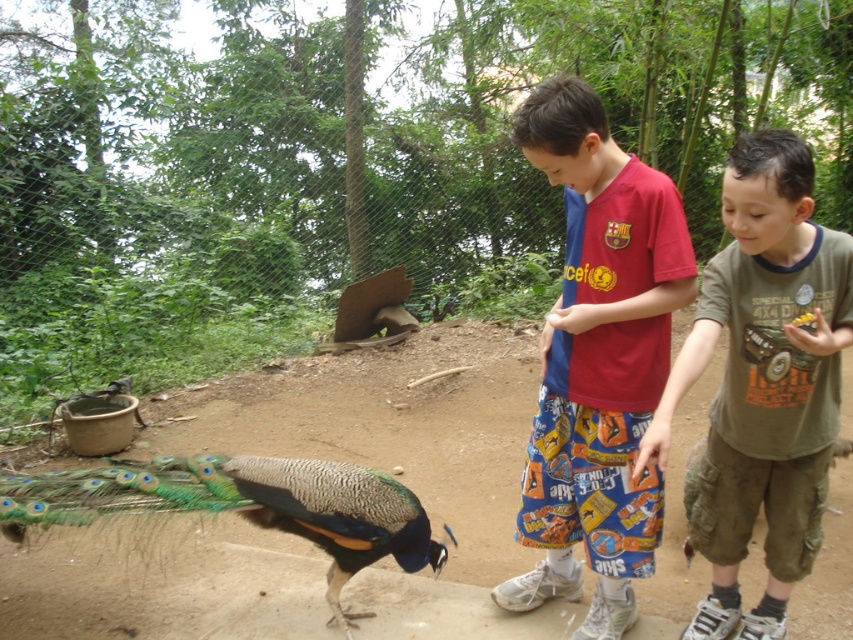
Looking at this image, you are a zoo visitor standing on the dirt path. You see the point marked at (762, 384). What object is located at that point?

The point at (762, 384) corresponds to the green cargo shorts at lower right.

You are a zookeeper who needs to ensure the safety of the animals. You notice the red cotton shirt at center and the shiny iridescent peacock at lower left in the enclosure. Which object is closer to the chain link fence boundary?

The red cotton shirt at center is in front of the shiny iridescent peacock at lower left, meaning it is closer to the chain link fence boundary.